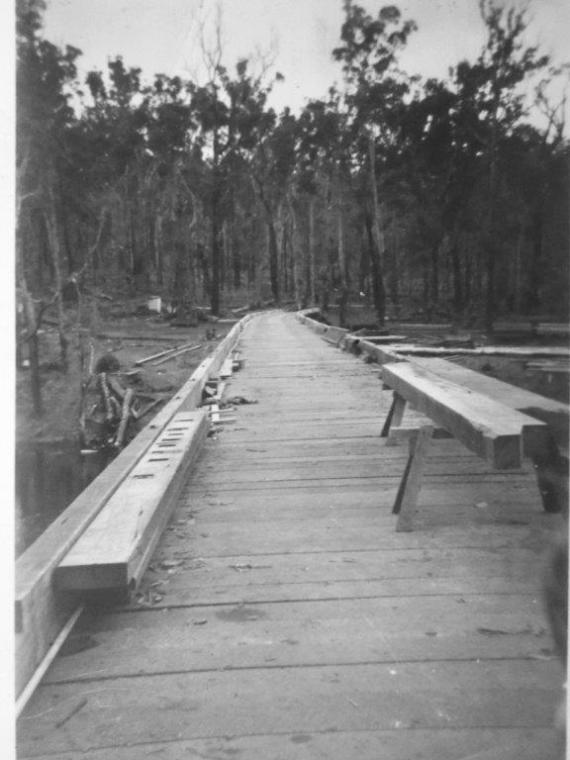
Find the location of a particular element. This screenshot has height=760, width=570. wood piece is located at coordinates (156, 597).